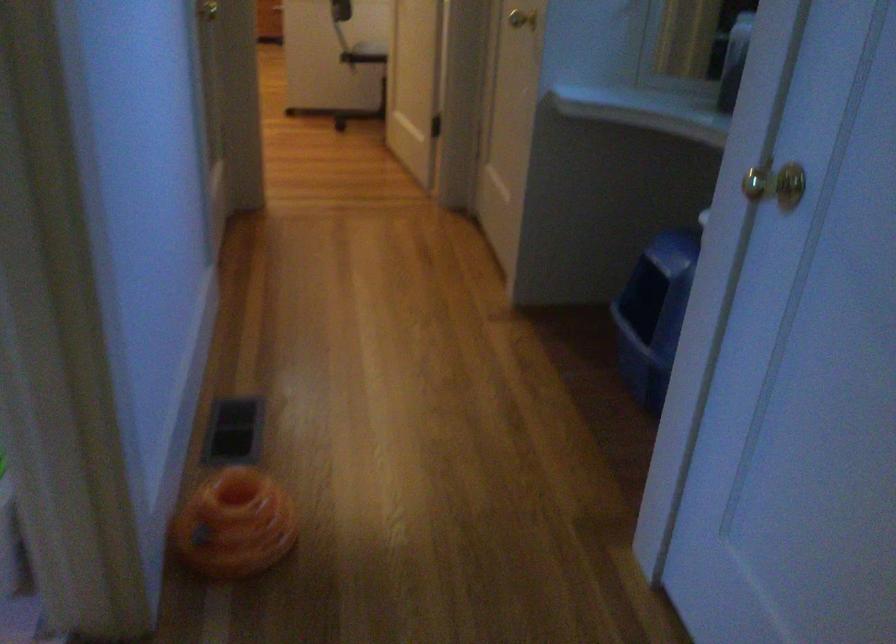
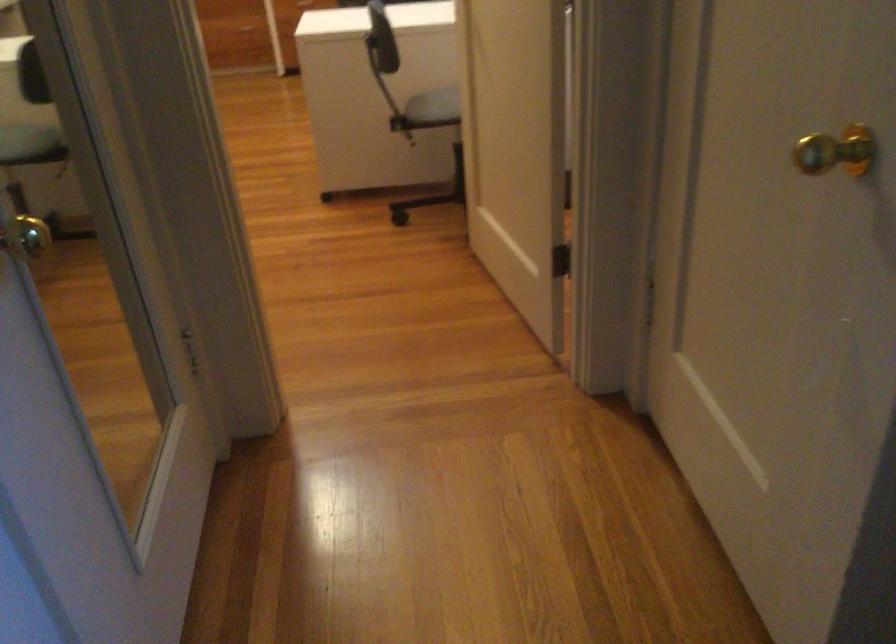
Question: In a continuous first-person perspective shot, in which direction is the camera moving?

Choices:
 (A) Left
 (B) Right
 (C) Forward
 (D) Backward

Answer: (C)